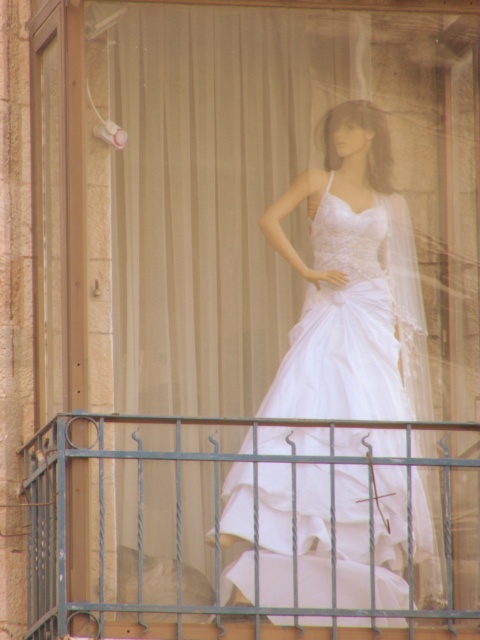
Can you confirm if white satin dress at center is thinner than metallic wrought iron railing at lower center?

Yes, white satin dress at center is thinner than metallic wrought iron railing at lower center.

What do you see at coordinates (352, 285) in the screenshot? Image resolution: width=480 pixels, height=640 pixels. I see `white satin dress at center` at bounding box center [352, 285].

Identify the location of white satin dress at center. (352, 285).